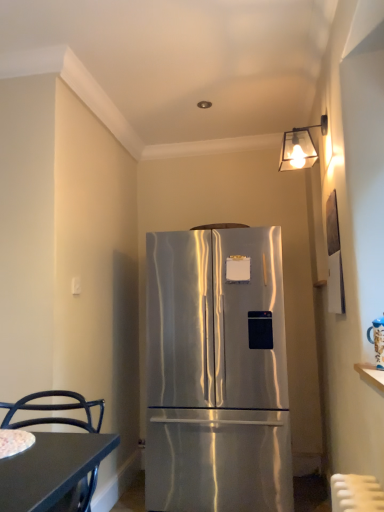
Question: Is point (297, 147) closer or farther from the camera than point (91, 497)?

Choices:
 (A) farther
 (B) closer

Answer: (B)

Question: From a real-world perspective, is metallic glass lampshade at upper right above or below black metal chair at lower left?

Choices:
 (A) below
 (B) above

Answer: (B)

Question: Which object is positioned farthest from the black metal chair at lower left?

Choices:
 (A) metallic glass lampshade at upper right
 (B) stainless steel refrigerator at center

Answer: (A)

Question: Which object is positioned closest to the metallic glass lampshade at upper right?

Choices:
 (A) black metal chair at lower left
 (B) stainless steel refrigerator at center

Answer: (B)